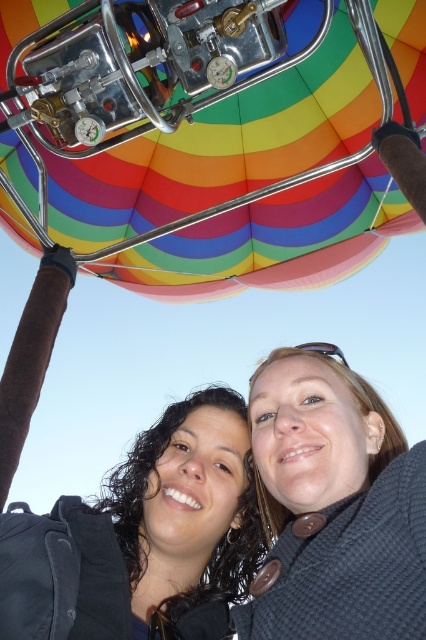
You are a photographer taking a picture of the rainbow fabric balloon at upper center and the smooth skin face at center. Which object is located above the other?

The rainbow fabric balloon at upper center is positioned over smooth skin face at center.

You are a photographer trying to capture a photo of the rainbow fabric balloon at upper center and the smooth skin face at center. Based on their sizes, which object should you focus on first to ensure it fits entirely in the frame?

The rainbow fabric balloon at upper center has a larger width than the smooth skin face at center, so you should focus on ensuring the rainbow fabric balloon at upper center fits first since it requires more space in the frame.

You are a photographer standing at the center of the hot air balloon. You want to take a photo of the rainbow fabric balloon at upper center and the smooth skin face at center. Can you fit both subjects into the frame of your camera, which has a maximum distance of 8 feet between the closest and farthest objects?

The rainbow fabric balloon at upper center and smooth skin face at center are 8.33 feet apart, which exceeds the camera frame limit of 8 feet. Therefore, both subjects cannot be captured in the same frame.